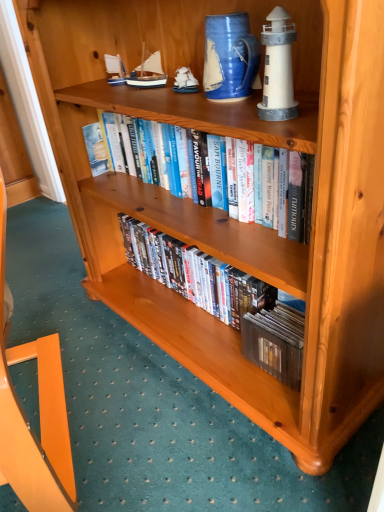
Locate an element on the screen. This screenshot has height=512, width=384. vacant area in front of matte wooden dvds at center, the 1th book positioned from the bottom is located at coordinates (201, 443).